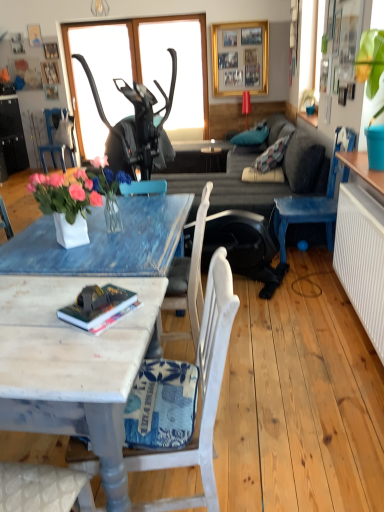
Where is `free space in front of hardcover book at center`? The height and width of the screenshot is (512, 384). free space in front of hardcover book at center is located at coordinates (88, 347).